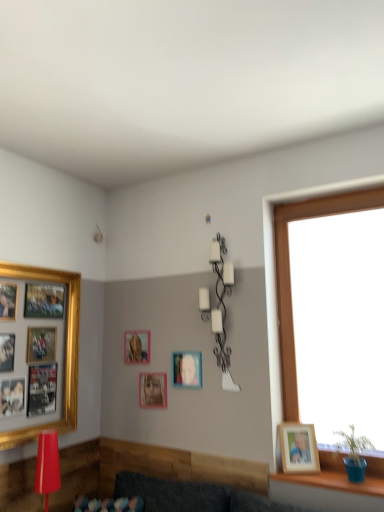
What do you see at coordinates (334, 482) in the screenshot?
I see `blue plastic pot at lower right` at bounding box center [334, 482].

This screenshot has width=384, height=512. In order to click on pink matte picture frame at center, which appears as the 3th picture frame when viewed from the right in this screenshot , I will do `click(153, 390)`.

The image size is (384, 512). Identify the location of matte red lamp at lower left, which is the first lamp from left to right. (47, 465).

What is the approximate width of matte plastic picture frame at center, placed as the 2th picture frame when sorted from right to left?

0.73 inches.

How much space does matte plastic picture frame at center, placed as the 2th picture frame when sorted from right to left, occupy vertically?

It is 9.01 inches.

At what (x,y) coordinates should I click in order to perform the action: click on white matte wall sconce at upper center, the 1th lamp in the right-to-left sequence. Please return your answer as a coordinate pair (x, y). The width and height of the screenshot is (384, 512). Looking at the image, I should click on (219, 309).

You are a GUI agent. You are given a task and a screenshot of the screen. Output one action in this format:
    pyautogui.click(x=<x>, y=<y>)
    Task: Click on the matte gold picture frame at center, which ranks as the 2th picture frame in left-to-right order
    
    Given the screenshot: What is the action you would take?
    pyautogui.click(x=137, y=347)

Are matte plastic picture frame at center, which ranks as the 4th picture frame in left-to-right order, and gold-framed collage at left, which ranks as the fifth picture frame in right-to-left order, making contact?

No, matte plastic picture frame at center, which ranks as the 4th picture frame in left-to-right order, is not touching gold-framed collage at left, which ranks as the fifth picture frame in right-to-left order.

From the image's perspective, is matte plastic picture frame at center, placed as the 2th picture frame when sorted from right to left, below gold-framed collage at left, which ranks as the fifth picture frame in right-to-left order?

Yes.

Is matte plastic picture frame at center, placed as the 2th picture frame when sorted from right to left, located outside gold-framed collage at left, the first picture frame viewed from the left?

Yes, matte plastic picture frame at center, placed as the 2th picture frame when sorted from right to left, is not within gold-framed collage at left, the first picture frame viewed from the left.

Identify the location of the 1st picture frame above the matte plastic picture frame at center, placed as the 2th picture frame when sorted from right to left (from a real-world perspective). (65, 351).

Does matte plastic picture frame at center, placed as the 2th picture frame when sorted from right to left, turn towards pink matte picture frame at center, which appears as the 3th picture frame when viewed from the right?

No, matte plastic picture frame at center, placed as the 2th picture frame when sorted from right to left, does not turn towards pink matte picture frame at center, which appears as the 3th picture frame when viewed from the right.

Looking at this image, is matte plastic picture frame at center, placed as the 2th picture frame when sorted from right to left, wider than pink matte picture frame at center, the third picture frame from the left?

No, matte plastic picture frame at center, placed as the 2th picture frame when sorted from right to left, is not wider than pink matte picture frame at center, the third picture frame from the left.

Measure the distance from matte plastic picture frame at center, placed as the 2th picture frame when sorted from right to left, to pink matte picture frame at center, which appears as the 3th picture frame when viewed from the right.

The distance of matte plastic picture frame at center, placed as the 2th picture frame when sorted from right to left, from pink matte picture frame at center, which appears as the 3th picture frame when viewed from the right, is 7.43 inches.

Is matte plastic picture frame at center, placed as the 2th picture frame when sorted from right to left, with pink matte picture frame at center, which appears as the 3th picture frame when viewed from the right?

No, matte plastic picture frame at center, placed as the 2th picture frame when sorted from right to left, is not making contact with pink matte picture frame at center, which appears as the 3th picture frame when viewed from the right.

Where is `picture frame that is the 1st object directly below the matte gold picture frame at center, which ranks as the 2th picture frame in left-to-right order (from a real-world perspective)`? The width and height of the screenshot is (384, 512). picture frame that is the 1st object directly below the matte gold picture frame at center, which ranks as the 2th picture frame in left-to-right order (from a real-world perspective) is located at coordinates (65, 351).

Based on the photo, is matte gold picture frame at center, arranged as the 4th picture frame when viewed from the right, positioned far away from gold-framed collage at left, which ranks as the fifth picture frame in right-to-left order?

They are positioned close to each other.

From the picture: Is matte gold picture frame at center, which ranks as the 2th picture frame in left-to-right order, looking in the opposite direction of gold-framed collage at left, which ranks as the fifth picture frame in right-to-left order?

matte gold picture frame at center, which ranks as the 2th picture frame in left-to-right order, is not turned away from gold-framed collage at left, which ranks as the fifth picture frame in right-to-left order.

From the image's perspective, between matte gold picture frame at center, which ranks as the 2th picture frame in left-to-right order, and gold-framed collage at left, which ranks as the fifth picture frame in right-to-left order, which one is located above?

gold-framed collage at left, which ranks as the fifth picture frame in right-to-left order, from the image's perspective.

Can we say matte plastic picture frame at center, placed as the 2th picture frame when sorted from right to left, lies outside matte red lamp at lower left, marked as the 2th lamp in a right-to-left arrangement?

Yes, matte plastic picture frame at center, placed as the 2th picture frame when sorted from right to left, is outside of matte red lamp at lower left, marked as the 2th lamp in a right-to-left arrangement.

From a real-world perspective, is matte plastic picture frame at center, which ranks as the 4th picture frame in left-to-right order, positioned above or below matte red lamp at lower left, which is counted as the second lamp, starting from the top?

From a real-world perspective, matte plastic picture frame at center, which ranks as the 4th picture frame in left-to-right order, is physically above matte red lamp at lower left, which is counted as the second lamp, starting from the top.

Is matte plastic picture frame at center, placed as the 2th picture frame when sorted from right to left, positioned with its back to matte red lamp at lower left, which appears as the first lamp when viewed from the front?

matte plastic picture frame at center, placed as the 2th picture frame when sorted from right to left, does not have its back to matte red lamp at lower left, which appears as the first lamp when viewed from the front.

Are matte plastic picture frame at center, which ranks as the 4th picture frame in left-to-right order, and matte red lamp at lower left, which is counted as the first lamp, starting from the bottom, far apart?

matte plastic picture frame at center, which ranks as the 4th picture frame in left-to-right order, is near matte red lamp at lower left, which is counted as the first lamp, starting from the bottom, not far away.

Is gold-framed collage at left, which ranks as the fifth picture frame in right-to-left order, not inside pink matte picture frame at center, which appears as the 3th picture frame when viewed from the right?

Yes.

In the scene shown: From the image's perspective, which is below, gold-framed collage at left, which ranks as the fifth picture frame in right-to-left order, or pink matte picture frame at center, which appears as the 3th picture frame when viewed from the right?

pink matte picture frame at center, which appears as the 3th picture frame when viewed from the right, is shown below in the image.

What's the angular difference between gold-framed collage at left, the first picture frame viewed from the left, and pink matte picture frame at center, which appears as the 3th picture frame when viewed from the right,'s facing directions?

gold-framed collage at left, the first picture frame viewed from the left, and pink matte picture frame at center, which appears as the 3th picture frame when viewed from the right, are facing 89.6 degrees away from each other.

Considering the points (70, 424) and (150, 402), which point is behind, point (70, 424) or point (150, 402)?

The point (150, 402) is farther from the camera.

From the image's perspective, is matte plastic picture frame at center, placed as the 2th picture frame when sorted from right to left, over blue plastic pot at lower right?

Yes, from the image's perspective, matte plastic picture frame at center, placed as the 2th picture frame when sorted from right to left, is on top of blue plastic pot at lower right.

Considering the points (201, 355) and (361, 486), which point is in front, point (201, 355) or point (361, 486)?

The point (361, 486) is closer.

Considering the sizes of objects matte plastic picture frame at center, placed as the 2th picture frame when sorted from right to left, and blue plastic pot at lower right in the image provided, who is smaller, matte plastic picture frame at center, placed as the 2th picture frame when sorted from right to left, or blue plastic pot at lower right?

Smaller between the two is matte plastic picture frame at center, placed as the 2th picture frame when sorted from right to left.

From a real-world perspective, is matte plastic picture frame at center, placed as the 2th picture frame when sorted from right to left, positioned above or below blue plastic pot at lower right?

From a real-world perspective, matte plastic picture frame at center, placed as the 2th picture frame when sorted from right to left, is physically above blue plastic pot at lower right.

How different are the orientations of matte gold picture frame at center, arranged as the 4th picture frame when viewed from the right, and wooden photo frame at right, the fifth picture frame positioned from the left, in degrees?

28 degrees.

From the image's perspective, would you say matte gold picture frame at center, arranged as the 4th picture frame when viewed from the right, is shown under wooden photo frame at right, the fifth picture frame positioned from the left?

No.

Does matte gold picture frame at center, arranged as the 4th picture frame when viewed from the right, have a lesser height compared to wooden photo frame at right, which is the 1th picture frame from right to left?

Correct, matte gold picture frame at center, arranged as the 4th picture frame when viewed from the right, is not as tall as wooden photo frame at right, which is the 1th picture frame from right to left.

Does matte gold picture frame at center, arranged as the 4th picture frame when viewed from the right, touch wooden photo frame at right, which is the 1th picture frame from right to left?

No, matte gold picture frame at center, arranged as the 4th picture frame when viewed from the right, is not in contact with wooden photo frame at right, which is the 1th picture frame from right to left.

I want to click on the 3rd picture frame to the left when counting from the matte plastic picture frame at center, which ranks as the 4th picture frame in left-to-right order, so click(x=65, y=351).

From the pink matte picture frame at center, which appears as the 3th picture frame when viewed from the right, count 1st picture frame to the right and point to it. Please provide its 2D coordinates.

[(187, 369)]

When comparing their distances from matte gold picture frame at center, arranged as the 4th picture frame when viewed from the right, does matte plastic picture frame at center, which ranks as the 4th picture frame in left-to-right order, or white matte wall sconce at upper center, acting as the first lamp starting from the top, seem closer?

matte plastic picture frame at center, which ranks as the 4th picture frame in left-to-right order.

When comparing their distances from wooden photo frame at right, which is the 1th picture frame from right to left, does pink matte picture frame at center, the third picture frame from the left, or gold-framed collage at left, which ranks as the fifth picture frame in right-to-left order, seem further?

gold-framed collage at left, which ranks as the fifth picture frame in right-to-left order, is further to wooden photo frame at right, which is the 1th picture frame from right to left.

Estimate the real-world distances between objects in this image. Which object is further from matte gold picture frame at center, arranged as the 4th picture frame when viewed from the right, white matte wall sconce at upper center, which appears as the first lamp when viewed from the back, or blue plastic pot at lower right?

Among the two, blue plastic pot at lower right is located further to matte gold picture frame at center, arranged as the 4th picture frame when viewed from the right.

When comparing their distances from gold-framed collage at left, the first picture frame viewed from the left, does matte red lamp at lower left, the 2th lamp positioned from the back, or pink matte picture frame at center, the third picture frame from the left, seem closer?

The object closer to gold-framed collage at left, the first picture frame viewed from the left, is matte red lamp at lower left, the 2th lamp positioned from the back.

Based on their spatial positions, is gold-framed collage at left, which ranks as the fifth picture frame in right-to-left order, or matte plastic picture frame at center, placed as the 2th picture frame when sorted from right to left, further from matte red lamp at lower left, the 2th lamp positioned from the back?

matte plastic picture frame at center, placed as the 2th picture frame when sorted from right to left, is positioned further to the anchor matte red lamp at lower left, the 2th lamp positioned from the back.

When comparing their distances from pink matte picture frame at center, which appears as the 3th picture frame when viewed from the right, does matte gold picture frame at center, arranged as the 4th picture frame when viewed from the right, or matte plastic picture frame at center, placed as the 2th picture frame when sorted from right to left, seem further?

matte gold picture frame at center, arranged as the 4th picture frame when viewed from the right, is further to pink matte picture frame at center, which appears as the 3th picture frame when viewed from the right.

When comparing their distances from white matte wall sconce at upper center, marked as the second lamp in a left-to-right arrangement, does wooden photo frame at right, the fifth picture frame positioned from the left, or pink matte picture frame at center, the third picture frame from the left, seem closer?

wooden photo frame at right, the fifth picture frame positioned from the left, is closer to white matte wall sconce at upper center, marked as the second lamp in a left-to-right arrangement.

Considering their positions, is blue plastic pot at lower right positioned closer to gold-framed collage at left, which ranks as the fifth picture frame in right-to-left order, than pink matte picture frame at center, which appears as the 3th picture frame when viewed from the right?

The object closer to gold-framed collage at left, which ranks as the fifth picture frame in right-to-left order, is pink matte picture frame at center, which appears as the 3th picture frame when viewed from the right.

This screenshot has width=384, height=512. I want to click on picture frame between pink matte picture frame at center, which appears as the 3th picture frame when viewed from the right, and wooden photo frame at right, the fifth picture frame positioned from the left, so click(x=187, y=369).

Where is `lamp situated between gold-framed collage at left, the first picture frame viewed from the left, and white matte wall sconce at upper center, marked as the second lamp in a left-to-right arrangement, from left to right`? lamp situated between gold-framed collage at left, the first picture frame viewed from the left, and white matte wall sconce at upper center, marked as the second lamp in a left-to-right arrangement, from left to right is located at coordinates (47, 465).

Where is `lamp located between gold-framed collage at left, the first picture frame viewed from the left, and matte plastic picture frame at center, which ranks as the 4th picture frame in left-to-right order, in the left-right direction`? The width and height of the screenshot is (384, 512). lamp located between gold-framed collage at left, the first picture frame viewed from the left, and matte plastic picture frame at center, which ranks as the 4th picture frame in left-to-right order, in the left-right direction is located at coordinates (47, 465).

Identify the location of lamp between matte gold picture frame at center, arranged as the 4th picture frame when viewed from the right, and wooden photo frame at right, which is the 1th picture frame from right to left, in the horizontal direction. (219, 309).